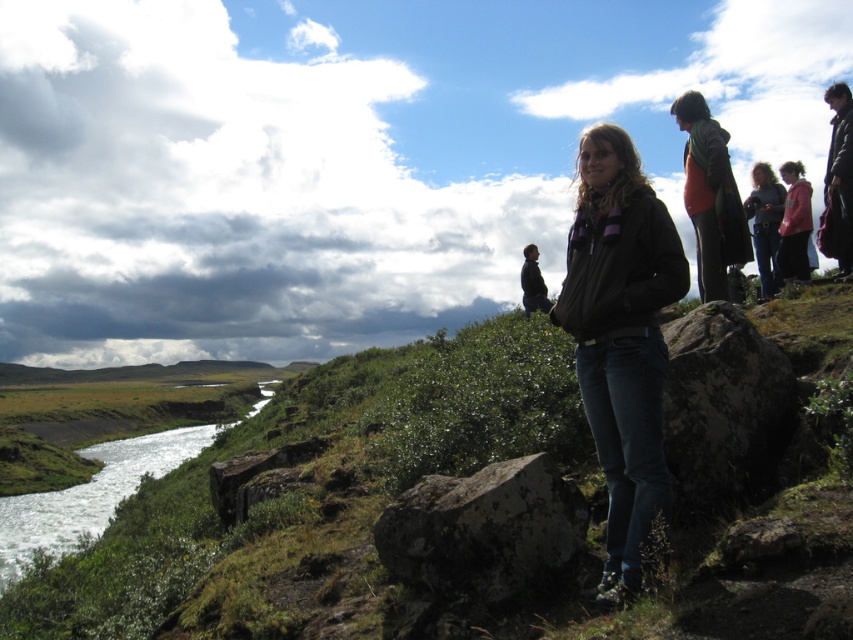
Question: Considering the relative positions of rusty metallic rock at lower left and dark brown leather jacket at center in the image provided, where is rusty metallic rock at lower left located with respect to dark brown leather jacket at center?

Choices:
 (A) above
 (B) below

Answer: (B)

Question: Which of these objects is positioned closest to the green mossy hillside at center?

Choices:
 (A) green grassy creek at lower left
 (B) lichen-covered rock at center

Answer: (B)

Question: Which point is farther from the camera taking this photo?

Choices:
 (A) (599, 250)
 (B) (543, 300)

Answer: (B)

Question: Considering the relative positions of speckled gray rock at center and green grassy creek at lower left in the image provided, where is speckled gray rock at center located with respect to green grassy creek at lower left?

Choices:
 (A) right
 (B) left

Answer: (A)

Question: Does matte black jacket at upper right have a lesser width compared to rusty metallic rock at lower left?

Choices:
 (A) yes
 (B) no

Answer: (B)

Question: Which is nearer to the dark brown leather jacket at center?

Choices:
 (A) black fuzzy jacket at upper right
 (B) matte black jacket at upper right
 (C) lichen-covered rock at center

Answer: (B)